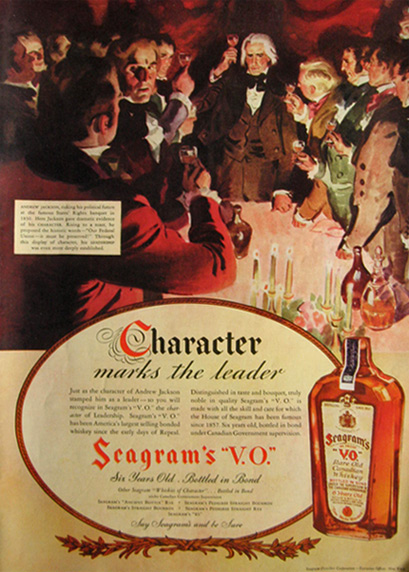
I want to click on candles, so click(x=257, y=279), click(x=273, y=278), click(x=288, y=279), click(x=327, y=300), click(x=348, y=313).